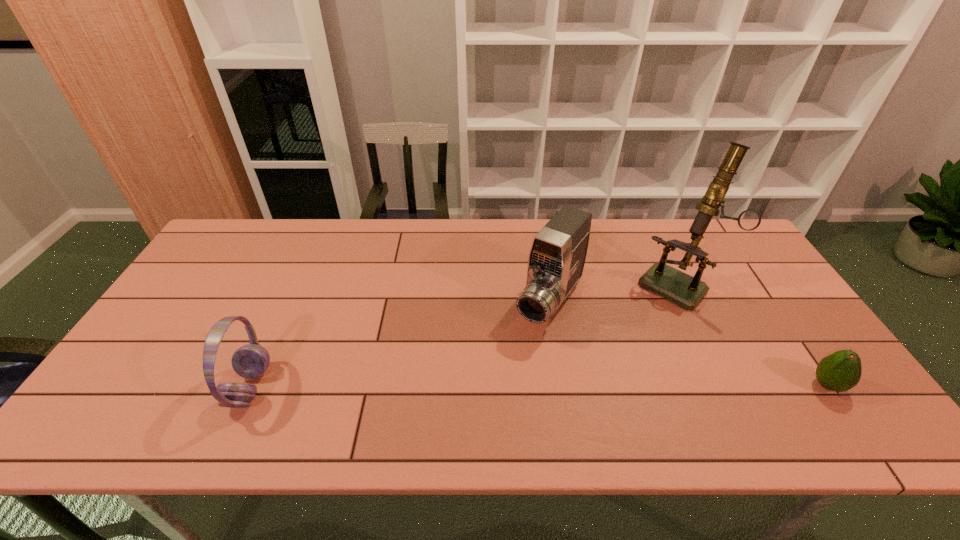
The width and height of the screenshot is (960, 540). I want to click on headset, so click(x=250, y=361).

Where is `the second shortest object`? This screenshot has height=540, width=960. the second shortest object is located at coordinates (250, 361).

Find the location of a particular element. the rightmost object is located at coordinates (840, 371).

Find the location of `the shortest object`. the shortest object is located at coordinates (840, 371).

Find the location of `the tallest object`. the tallest object is located at coordinates (686, 291).

Find the location of a particular element. the third object from left to right is located at coordinates (686, 291).

At what (x,y) coordinates should I click in order to perform the action: click on camcorder. Please return your answer as a coordinate pair (x, y). The height and width of the screenshot is (540, 960). Looking at the image, I should click on (558, 252).

The height and width of the screenshot is (540, 960). I want to click on the third object from right to left, so click(x=558, y=252).

Where is `vacant space located on the headband and ear cups of the third tallest object`? The image size is (960, 540). vacant space located on the headband and ear cups of the third tallest object is located at coordinates (406, 387).

Locate an element on the screen. vacant space located on the left of the shortest object is located at coordinates (756, 386).